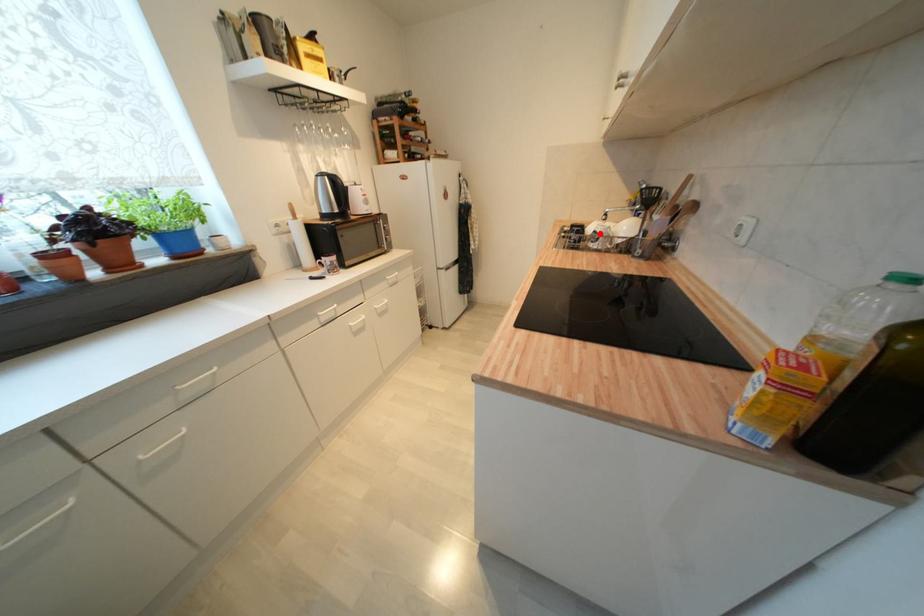
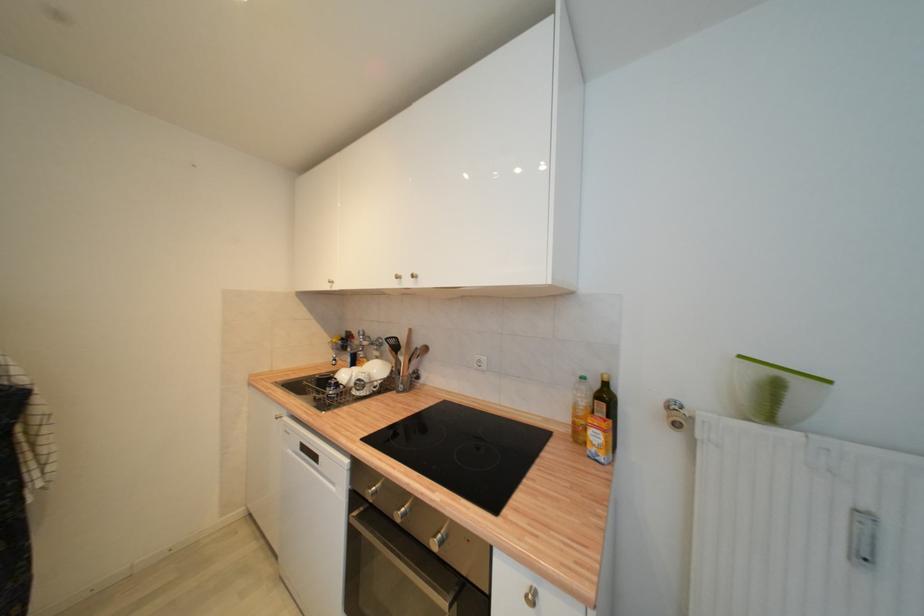
Locate, in the second image, the point that corresponds to the highlighted location in the first image.

(363, 382)